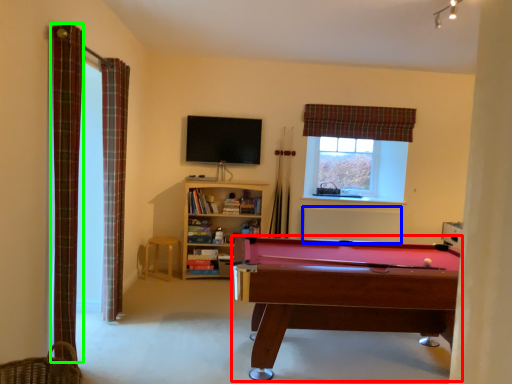
Question: Based on their relative distances, which object is nearer to billiard table (highlighted by a red box)? Choose from radiator (highlighted by a blue box) and curtain (highlighted by a green box).

Choices:
 (A) radiator
 (B) curtain

Answer: (B)